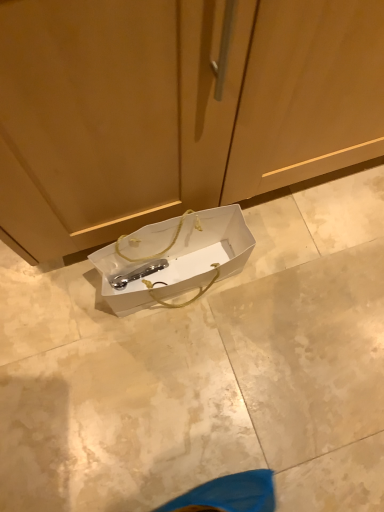
Describe the element at coordinates (175, 108) in the screenshot. The width and height of the screenshot is (384, 512). I see `matte wood cabinet at center` at that location.

At what (x,y) coordinates should I click in order to perform the action: click on matte wood cabinet at center. Please return your answer as a coordinate pair (x, y). This screenshot has width=384, height=512. Looking at the image, I should click on (175, 108).

You are a GUI agent. You are given a task and a screenshot of the screen. Output one action in this format:
    pyautogui.click(x=<x>, y=<y>)
    Task: Click on the white paper bag at center
    Image resolution: width=384 pixels, height=512 pixels.
    Given the screenshot: What is the action you would take?
    pyautogui.click(x=205, y=250)

What do you see at coordinates (205, 250) in the screenshot? I see `white paper bag at center` at bounding box center [205, 250].

Where is `matte wood cabinet at center`? matte wood cabinet at center is located at coordinates (175, 108).

Which object is positioned more to the right, matte wood cabinet at center or white paper bag at center?

matte wood cabinet at center.

Relative to white paper bag at center, is matte wood cabinet at center in front or behind?

In the image, matte wood cabinet at center appears in front of white paper bag at center.

Between point (163, 13) and point (139, 295), which one is positioned in front?

Point (163, 13)

From the image's perspective, is matte wood cabinet at center above white paper bag at center?

Correct, matte wood cabinet at center appears higher than white paper bag at center in the image.

In the scene shown: From a real-world perspective, is matte wood cabinet at center on white paper bag at center?

Yes, from a real-world perspective, matte wood cabinet at center is above white paper bag at center.

Considering the sizes of objects matte wood cabinet at center and white paper bag at center in the image provided, who is wider, matte wood cabinet at center or white paper bag at center?

With larger width is matte wood cabinet at center.

Considering the sizes of objects matte wood cabinet at center and white paper bag at center in the image provided, who is shorter, matte wood cabinet at center or white paper bag at center?

With less height is white paper bag at center.

Looking at this image, between matte wood cabinet at center and white paper bag at center, which one has smaller size?

With smaller size is white paper bag at center.

Is matte wood cabinet at center not inside white paper bag at center?

Yes, matte wood cabinet at center is not within white paper bag at center.

Are matte wood cabinet at center and white paper bag at center far apart?

No, matte wood cabinet at center is not far away from white paper bag at center.

Is matte wood cabinet at center turned away from white paper bag at center?

No, matte wood cabinet at center is not facing away from white paper bag at center.

What's the angular difference between matte wood cabinet at center and white paper bag at center's facing directions?

They differ by 0.315 degrees in their facing directions.

Measure the distance from matte wood cabinet at center to white paper bag at center.

matte wood cabinet at center is 7.92 inches from white paper bag at center.

You are a GUI agent. You are given a task and a screenshot of the screen. Output one action in this format:
    pyautogui.click(x=<x>, y=<y>)
    Task: Click on the box on the left side of matte wood cabinet at center
    
    Given the screenshot: What is the action you would take?
    pyautogui.click(x=205, y=250)

Is white paper bag at center to the left of matte wood cabinet at center from the viewer's perspective?

Yes.

In the image, is white paper bag at center positioned in front of or behind matte wood cabinet at center?

white paper bag at center is positioned farther from the viewer than matte wood cabinet at center.

Which is behind, point (190, 266) or point (164, 49)?

The point (190, 266) is behind.

From the image's perspective, is white paper bag at center positioned above or below matte wood cabinet at center?

white paper bag at center is situated lower than matte wood cabinet at center in the image.

From a real-world perspective, is white paper bag at center over matte wood cabinet at center?

No, from a real-world perspective, white paper bag at center is not above matte wood cabinet at center.

Which object is thinner, white paper bag at center or matte wood cabinet at center?

white paper bag at center.

Which of these two, white paper bag at center or matte wood cabinet at center, stands shorter?

With less height is white paper bag at center.

Is white paper bag at center bigger or smaller than matte wood cabinet at center?

In the image, white paper bag at center appears to be smaller than matte wood cabinet at center.

Would you say matte wood cabinet at center is part of white paper bag at center's contents?

No, matte wood cabinet at center is not surrounded by white paper bag at center.

Is there a large distance between white paper bag at center and matte wood cabinet at center?

No.

Is white paper bag at center turned away from matte wood cabinet at center?

Correct, white paper bag at center is looking away from matte wood cabinet at center.

Find the location of a particular element. Image resolution: width=384 pixels, height=512 pixels. cabinetry above the white paper bag at center (from a real-world perspective) is located at coordinates (175, 108).

Where is `cabinetry that appears on the right of white paper bag at center`? The height and width of the screenshot is (512, 384). cabinetry that appears on the right of white paper bag at center is located at coordinates (175, 108).

Where is `cabinetry above the white paper bag at center (from the image's perspective)`? This screenshot has width=384, height=512. cabinetry above the white paper bag at center (from the image's perspective) is located at coordinates (175, 108).